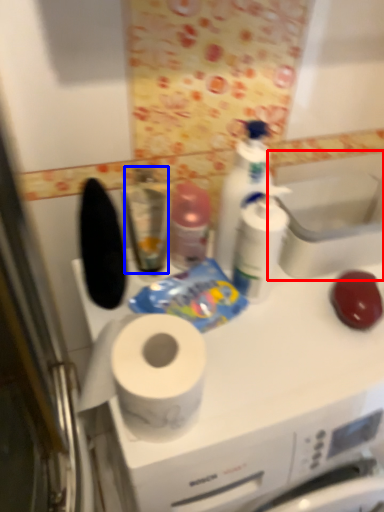
Question: Which point is further to the camera, sink (highlighted by a red box) or mouthwash (highlighted by a blue box)?

Choices:
 (A) sink
 (B) mouthwash

Answer: (A)